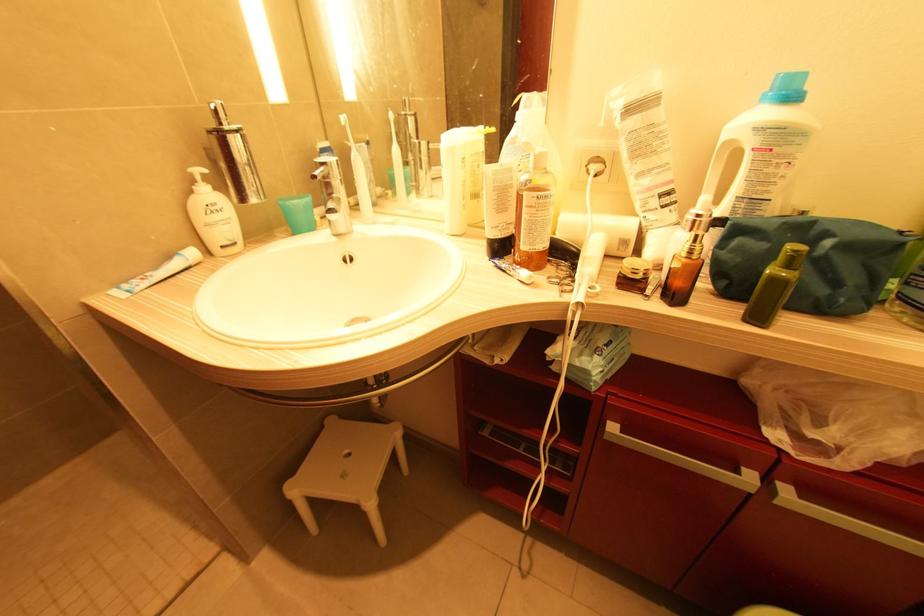
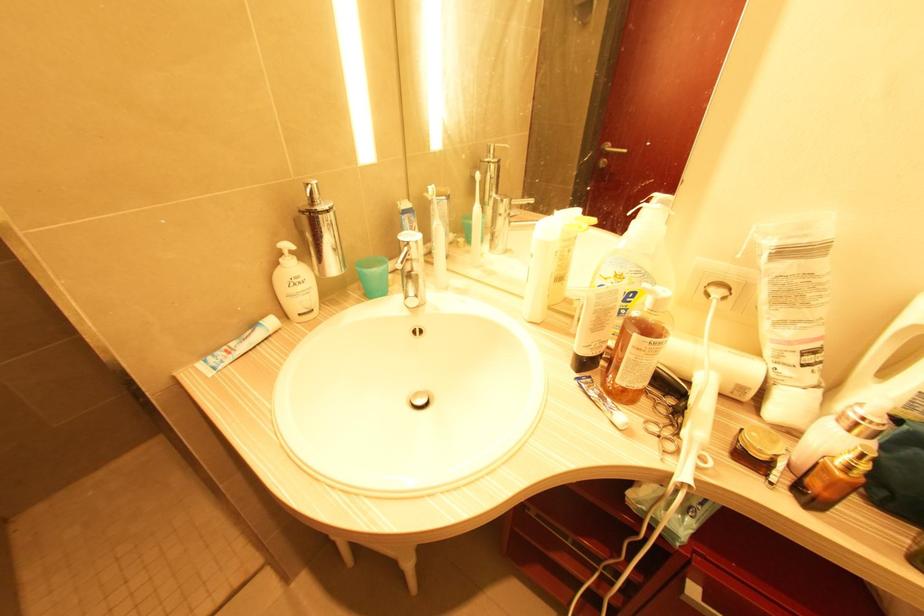
The point at (643, 270) is marked in the first image. Where is the corresponding point in the second image?

(773, 454)